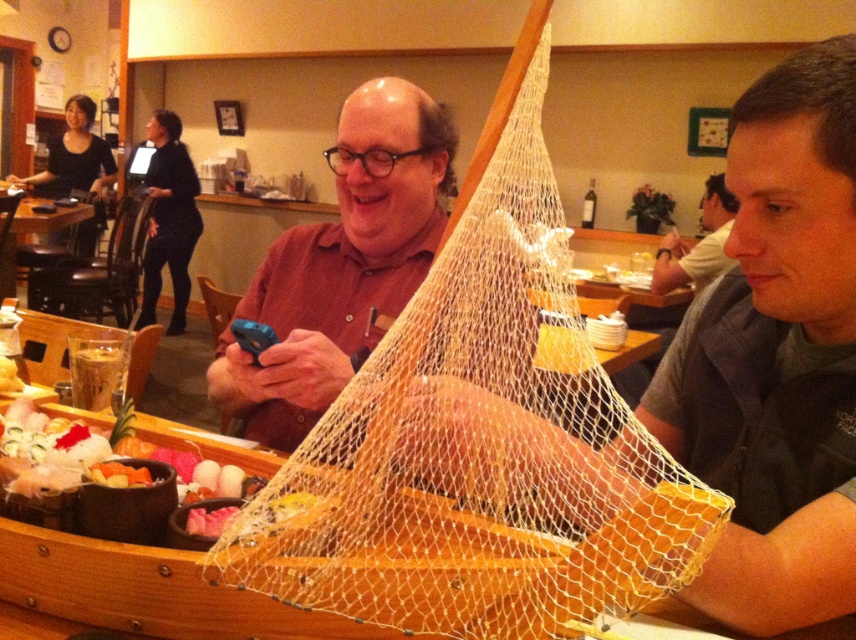
Question: Can you confirm if white mesh net at center is smaller than matte brown shirt at center?

Choices:
 (A) yes
 (B) no

Answer: (B)

Question: From the image, what is the correct spatial relationship of white mesh net at center in relation to gray fabric shirt at right?

Choices:
 (A) left
 (B) right

Answer: (A)

Question: Does white mesh net at center come behind gray fabric shirt at right?

Choices:
 (A) yes
 (B) no

Answer: (B)

Question: Among these objects, which one is farthest from the camera?

Choices:
 (A) matte brown shirt at center
 (B) gray fabric shirt at right
 (C) white mesh net at center

Answer: (B)

Question: Which point is farther from the camera taking this photo?

Choices:
 (A) (690, 273)
 (B) (352, 352)
 (C) (554, 317)

Answer: (A)

Question: Which object is the farthest from the matte brown shirt at center?

Choices:
 (A) gray fabric shirt at right
 (B) white mesh net at center

Answer: (A)